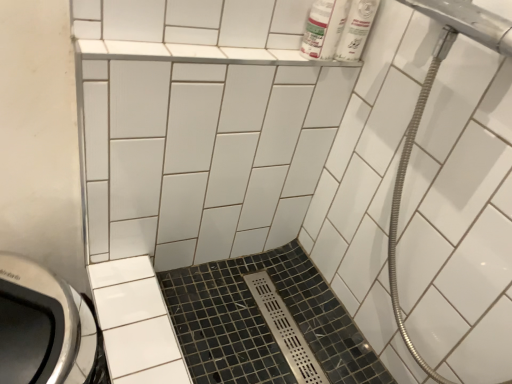
Question: Relative to metallic silver showerhead at upper right, is white plastic bottles at upper right in front or behind?

Choices:
 (A) behind
 (B) front

Answer: (A)

Question: From a real-world perspective, is white plastic bottles at upper right positioned above or below metallic silver showerhead at upper right?

Choices:
 (A) below
 (B) above

Answer: (B)

Question: Considering the real-world distances, which object is farthest from the metallic silver showerhead at upper right?

Choices:
 (A) white glossy ceramic tile at upper center, which is the second ceramic tile from bottom to top
 (B) white plastic bottles at upper right
 (C) black mosaic tile at center, arranged as the 1th ceramic tile when ordered from the bottom

Answer: (B)

Question: Estimate the real-world distances between objects in this image. Which object is closer to the white plastic bottles at upper right?

Choices:
 (A) black mosaic tile at center, arranged as the 1th ceramic tile when ordered from the bottom
 (B) metallic silver showerhead at upper right
 (C) white glossy ceramic tile at upper center, marked as the first ceramic tile in a top-to-bottom arrangement

Answer: (B)